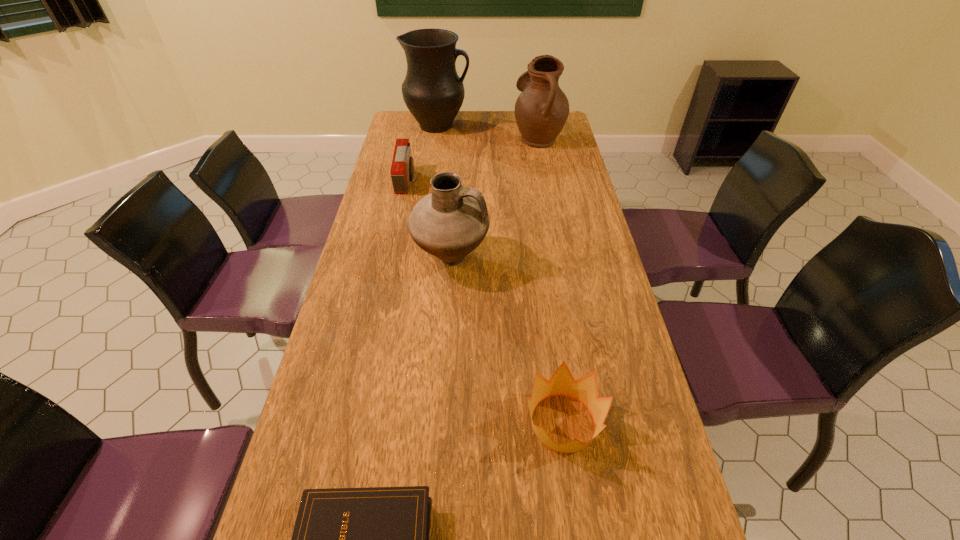
Find the location of `vacant space located on the back of the crown`. vacant space located on the back of the crown is located at coordinates (545, 296).

Where is `pitcher at the left edge`? pitcher at the left edge is located at coordinates (433, 92).

Find the location of a particular element. The image size is (960, 540). camera located in the left edge section of the desktop is located at coordinates (402, 169).

At what (x,y) coordinates should I click in order to perform the action: click on pitcher that is at the right edge. Please return your answer as a coordinate pair (x, y). Looking at the image, I should click on (541, 110).

Where is `crown positioned at the right edge`? The image size is (960, 540). crown positioned at the right edge is located at coordinates (584, 390).

In order to click on object positioned at the far left corner in this screenshot , I will do `click(433, 92)`.

Image resolution: width=960 pixels, height=540 pixels. I want to click on object located at the far right corner, so [541, 110].

The height and width of the screenshot is (540, 960). In the image, there is a desktop. Find the location of `vacant space at the left edge`. vacant space at the left edge is located at coordinates (334, 481).

Find the location of a particular element. This screenshot has height=540, width=960. free space at the far left corner is located at coordinates (410, 116).

At what (x,y) coordinates should I click in order to perform the action: click on free region at the far right corner of the desktop. Please return your answer as a coordinate pair (x, y). Image resolution: width=960 pixels, height=540 pixels. Looking at the image, I should click on (566, 124).